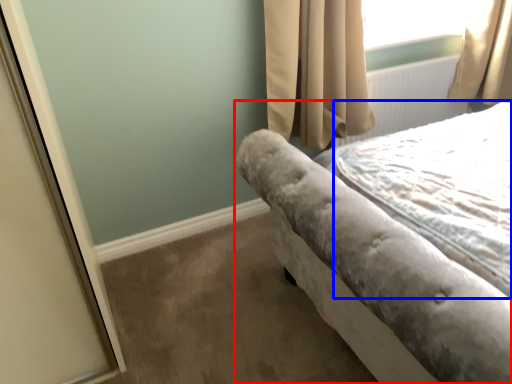
Question: Which point is closer to the camera, bed (highlighted by a red box) or sheet (highlighted by a blue box)?

Choices:
 (A) bed
 (B) sheet

Answer: (A)